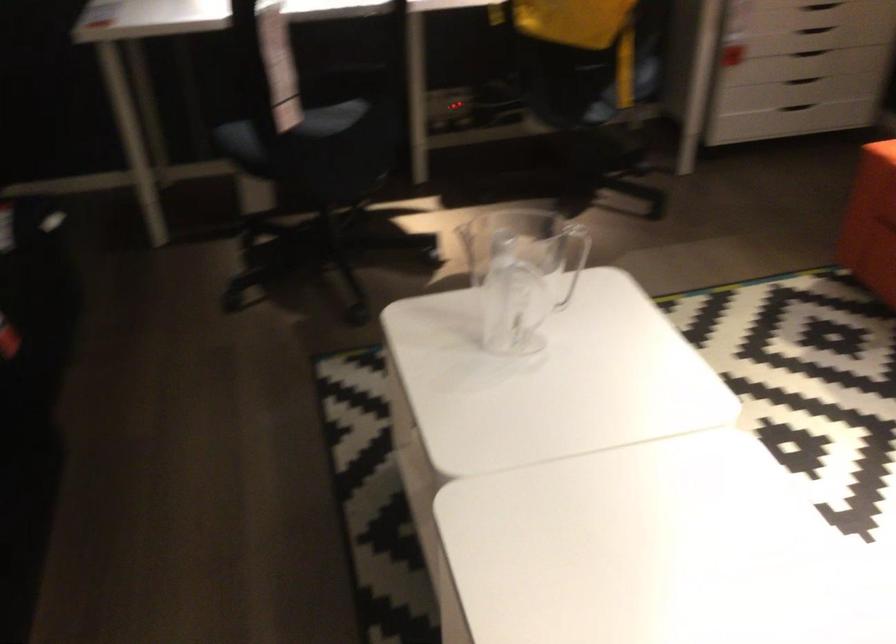
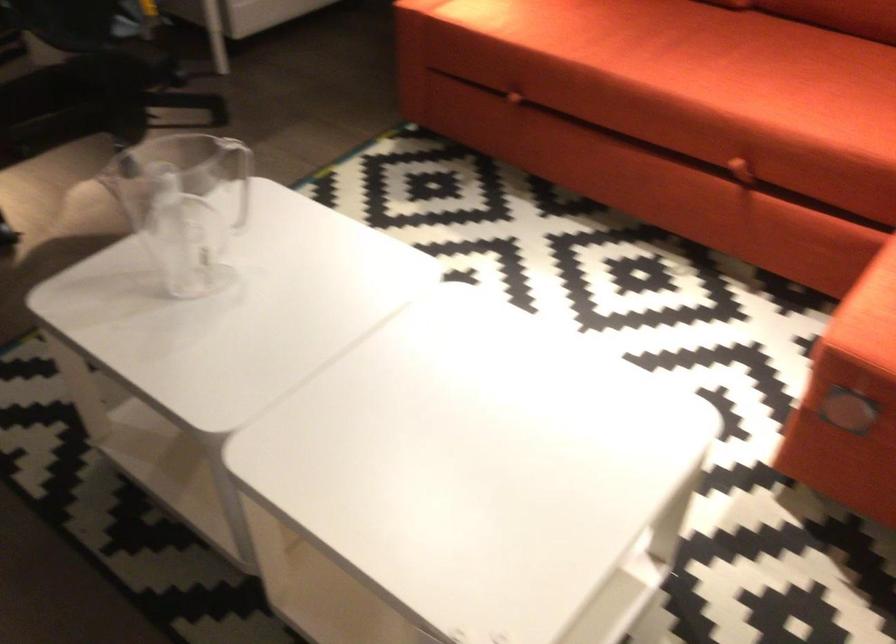
Question: The camera is either moving clockwise (left) or counter-clockwise (right) around the object. The first image is from the beginning of the video and the second image is from the end. Is the camera moving left or right when shooting the video?

Choices:
 (A) Left
 (B) Right

Answer: (A)